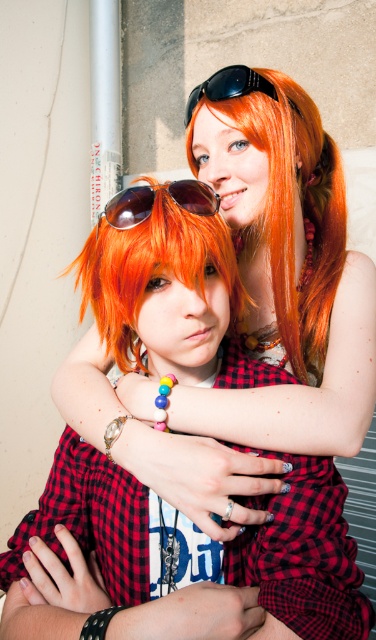
Who is taller, matte red plaid shirt at center or black plastic goggles at upper center?

matte red plaid shirt at center is taller.

Who is more distant from viewer, (95, 332) or (242, 65)?

The point (242, 65) is behind.

Identify the location of matte red plaid shirt at center. (197, 474).

How distant is orange matte wig at center from sunglasses at center?

They are 2.41 inches apart.

Who is positioned more to the left, orange matte wig at center or sunglasses at center?

From the viewer's perspective, sunglasses at center appears more on the left side.

This screenshot has width=376, height=640. Describe the element at coordinates (153, 257) in the screenshot. I see `orange matte wig at center` at that location.

Image resolution: width=376 pixels, height=640 pixels. Find the location of `orange matte wig at center`. orange matte wig at center is located at coordinates [153, 257].

Is orange glossy hair at upper center shorter than orange matte wig at center?

Incorrect, orange glossy hair at upper center's height does not fall short of orange matte wig at center's.

Does orange glossy hair at upper center appear on the right side of orange matte wig at center?

Indeed, orange glossy hair at upper center is positioned on the right side of orange matte wig at center.

This screenshot has height=640, width=376. Identify the location of orange glossy hair at upper center. (292, 208).